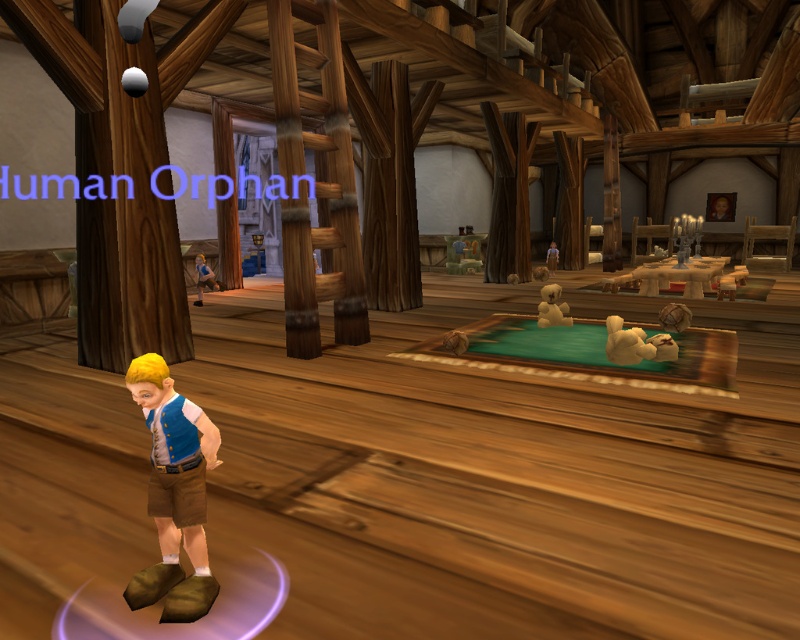
Question: Among these points, which one is nearest to the camera?

Choices:
 (A) (162, 515)
 (B) (548, 308)

Answer: (A)

Question: Does matte blue vest at lower left have a smaller size compared to white plush bear at center?

Choices:
 (A) yes
 (B) no

Answer: (A)

Question: Which object is closer to the camera taking this photo?

Choices:
 (A) matte blue vest at lower left
 (B) white plush bear at center

Answer: (A)

Question: Which of the following is the farthest from the observer?

Choices:
 (A) (558, 305)
 (B) (212, 449)

Answer: (A)

Question: Does matte blue vest at lower left have a greater width compared to white plush bear at center?

Choices:
 (A) yes
 (B) no

Answer: (B)

Question: Does matte blue vest at lower left appear on the left side of white plush bear at center?

Choices:
 (A) no
 (B) yes

Answer: (B)